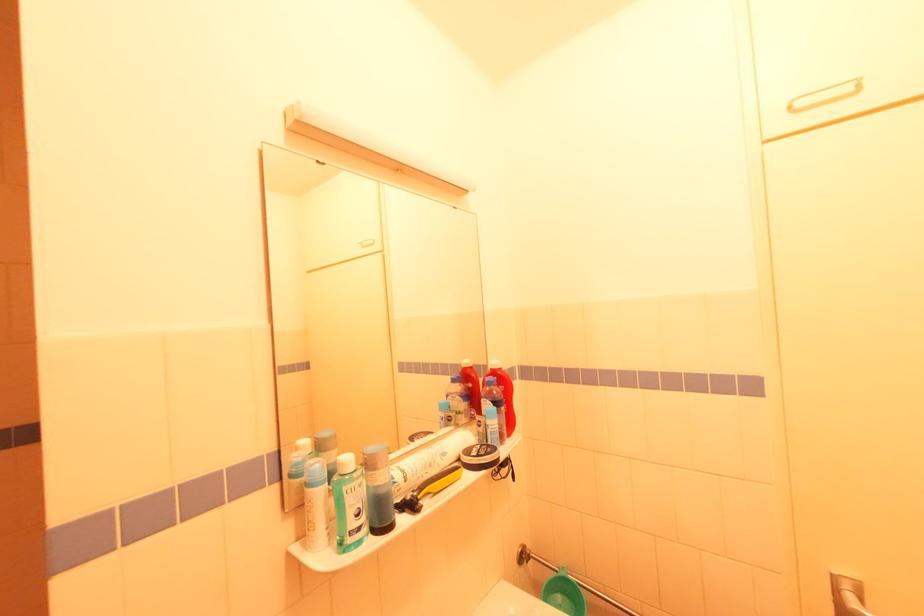
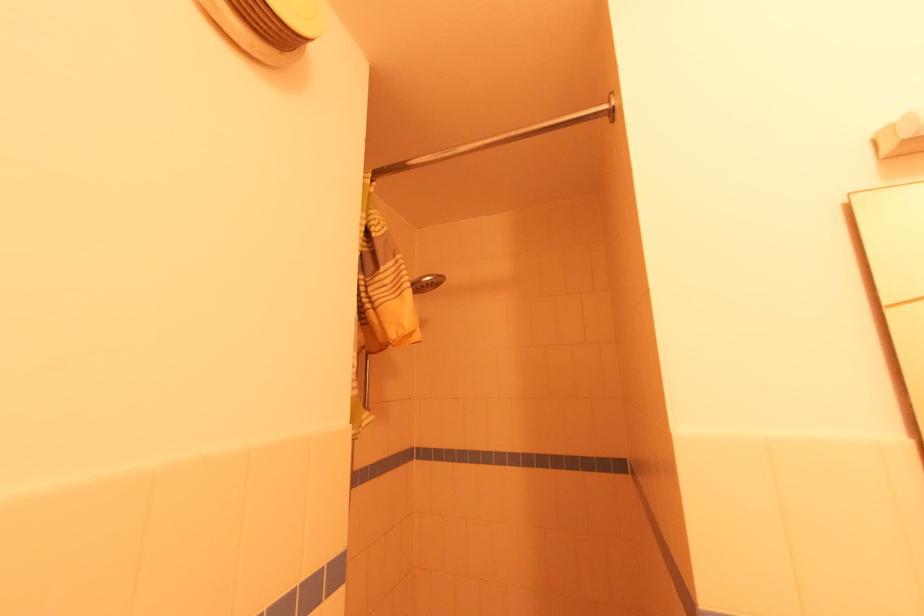
Question: Based on the continuous images, in which direction is the camera rotating? Reply with the corresponding letter.

Choices:
 (A) Left
 (B) Right
 (C) Up
 (D) Down

Answer: (A)